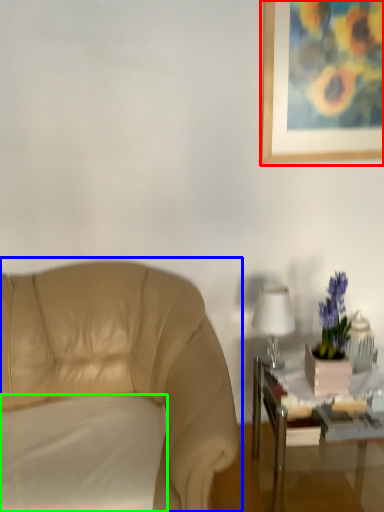
Question: Which is farther away from picture frame (highlighted by a red box)? chair (highlighted by a blue box) or pillow (highlighted by a green box)?

Choices:
 (A) chair
 (B) pillow

Answer: (B)